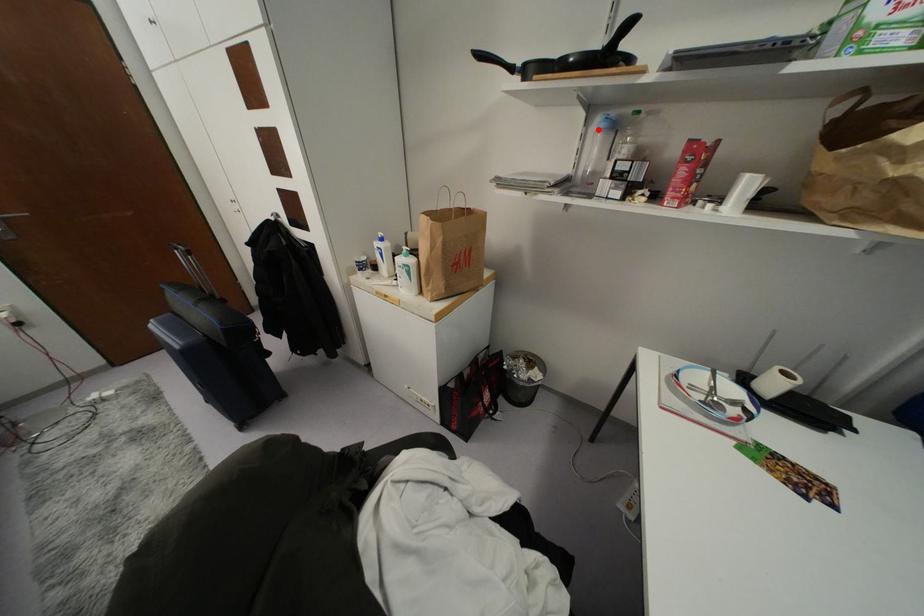
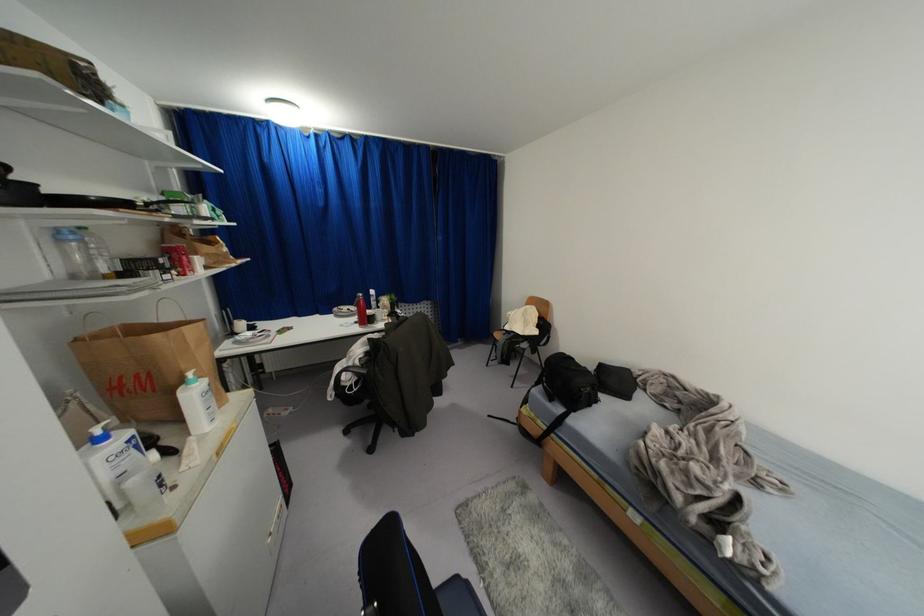
Question: A red point is marked in image1. In image2, is the corresponding 3D point closer to the camera or farther? Reply with the corresponding letter.

Choices:
 (A) The corresponding 3D point is closer.
 (B) The corresponding 3D point is farther.

Answer: (B)